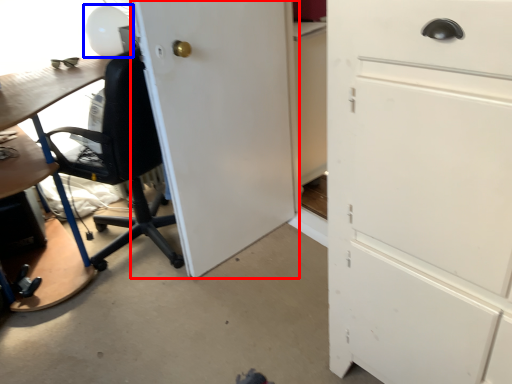
Question: Which point is closer to the camera, door (highlighted by a red box) or table lamp (highlighted by a blue box)?

Choices:
 (A) door
 (B) table lamp

Answer: (A)